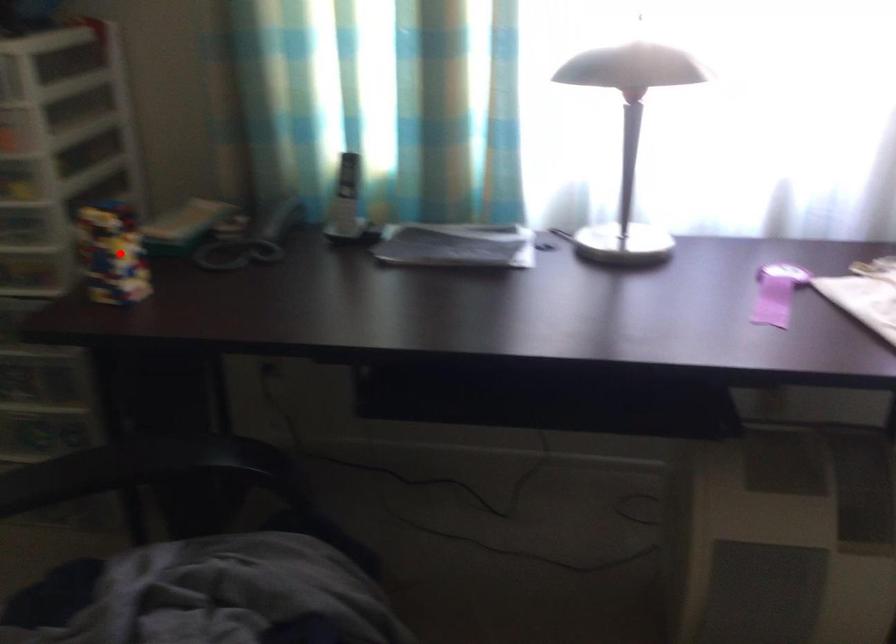
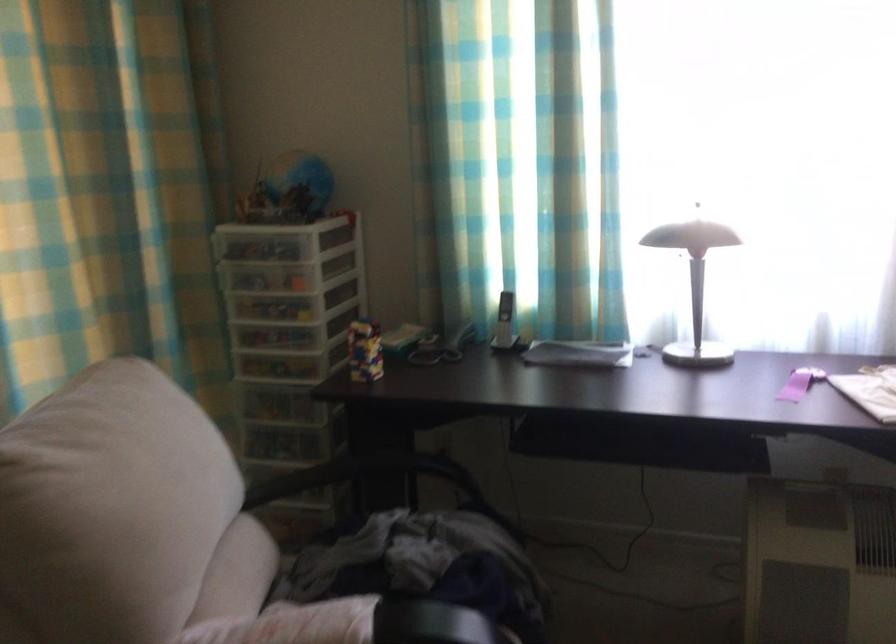
Question: A red point is marked in image1. In image2, is the corresponding 3D point closer to the camera or farther? Reply with the corresponding letter.

Choices:
 (A) The corresponding 3D point is closer.
 (B) The corresponding 3D point is farther.

Answer: (B)